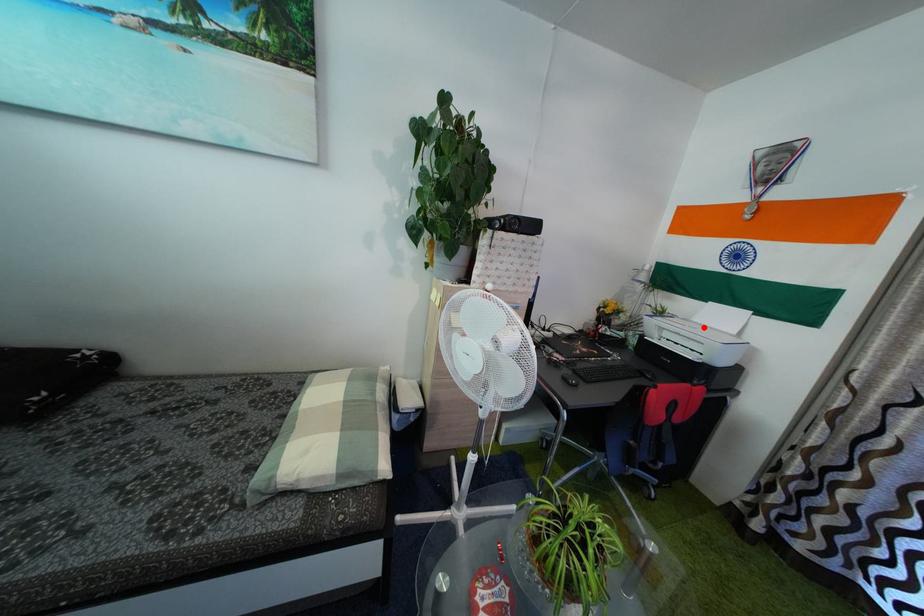
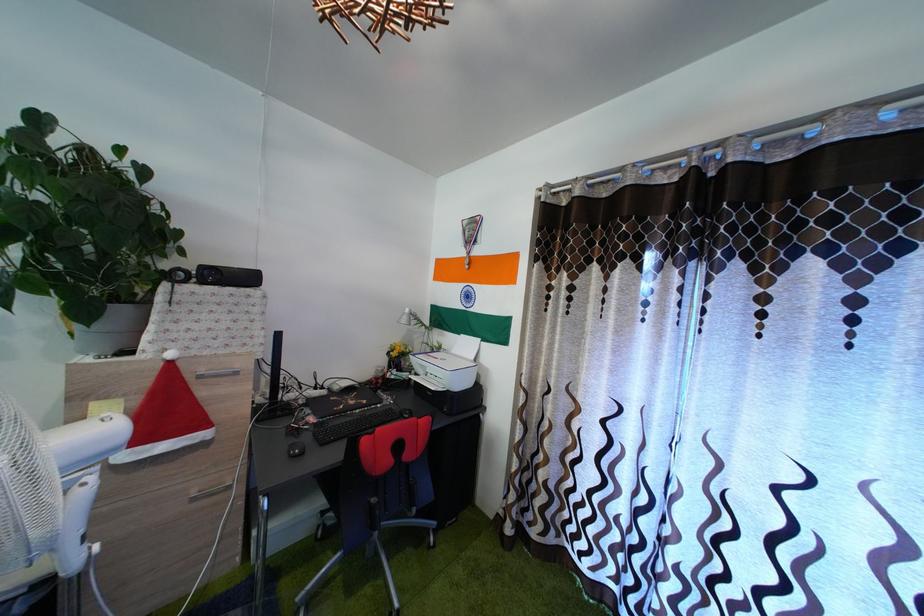
In the second image, find the point that corresponds to the highlighted location in the first image.

(462, 359)